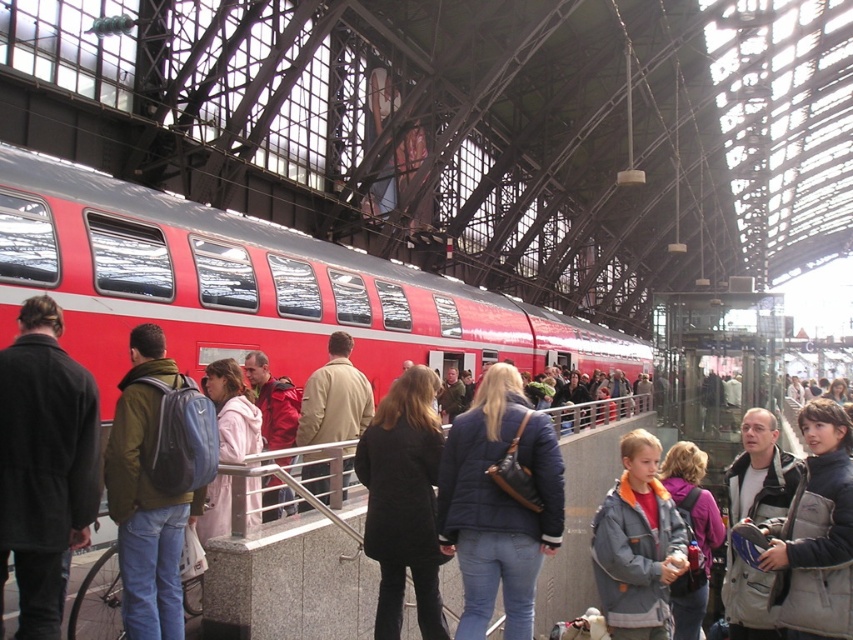
Question: Does dark brown wool coat at center appear under black wool coat at center?

Choices:
 (A) yes
 (B) no

Answer: (B)

Question: Estimate the real-world distances between objects in this image. Which object is closer to the gray fleece jacket at center?

Choices:
 (A) light pink fabric coat at center
 (B) red matte train at center
 (C) beige leather jacket at center

Answer: (C)

Question: Which of the following is the closest to the observer?

Choices:
 (A) (357, 417)
 (B) (637, 621)
 (C) (169, 516)
 (D) (828, 488)

Answer: (C)

Question: Can you confirm if navy blue quilted jacket at center is positioned above light pink fabric coat at center?

Choices:
 (A) yes
 (B) no

Answer: (B)

Question: In this image, where is dark brown wool coat at center located relative to gray fleece jacket at center?

Choices:
 (A) left
 (B) right

Answer: (A)

Question: Which object appears closest to the camera in this image?

Choices:
 (A) velvet brown jacket at center
 (B) light pink fabric coat at center
 (C) matte blue backpack at center

Answer: (C)